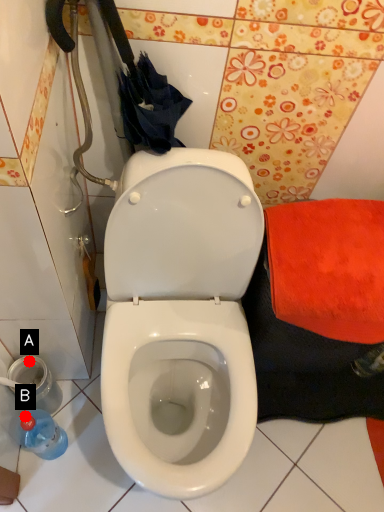
Question: Two points are circled on the image, labeled by A and B beside each circle. Which point is farther to the camera?

Choices:
 (A) A is further
 (B) B is further

Answer: (A)